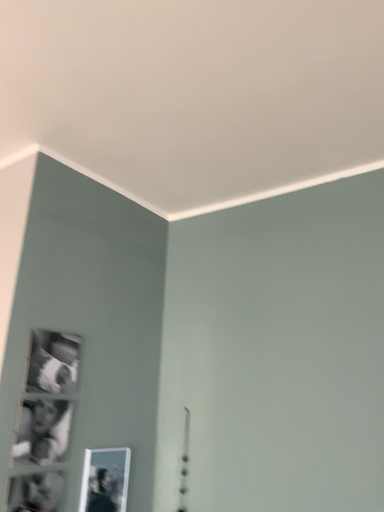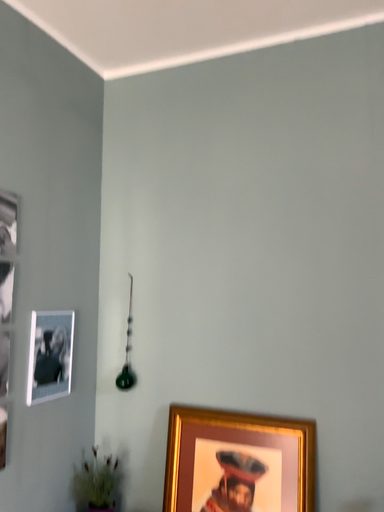
Question: Which way did the camera rotate in the video?

Choices:
 (A) rotated upward
 (B) rotated downward

Answer: (B)